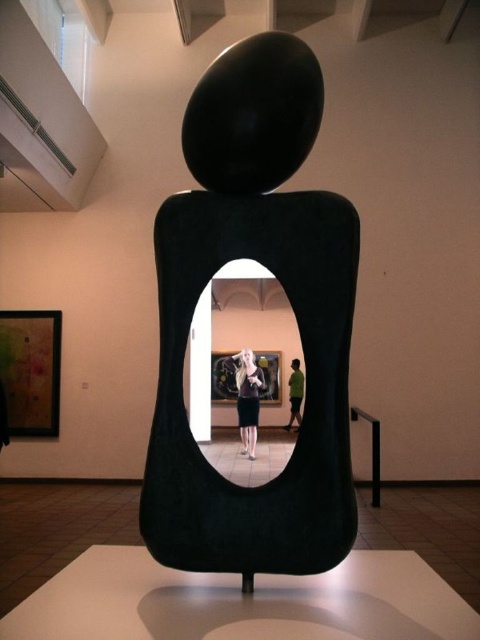
Measure the distance between point (271, 106) and camera.

4.95 feet

Does black matte sculpture at center have a lesser width compared to green matte shirt at center?

No.

Is point (245, 522) more distant than point (291, 371)?

No, it is not.

You are a GUI agent. You are given a task and a screenshot of the screen. Output one action in this format:
    pyautogui.click(x=<x>, y=<y>)
    Task: Click on the black matte sculpture at center
    
    Given the screenshot: What is the action you would take?
    pyautogui.click(x=291, y=307)

Does black matte sculpture at center appear on the left side of smooth black dress at center?

In fact, black matte sculpture at center is to the right of smooth black dress at center.

Measure the distance between black matte sculpture at center and smooth black dress at center.

The distance of black matte sculpture at center from smooth black dress at center is 7.56 meters.

This screenshot has height=640, width=480. In order to click on black matte sculpture at center in this screenshot , I will do `click(291, 307)`.

Can you confirm if smooth black dress at center is positioned below green matte shirt at center?

Actually, smooth black dress at center is above green matte shirt at center.

Which is above, smooth black dress at center or green matte shirt at center?

smooth black dress at center is above.

Where is `smooth black dress at center`? The width and height of the screenshot is (480, 640). smooth black dress at center is located at coordinates (248, 400).